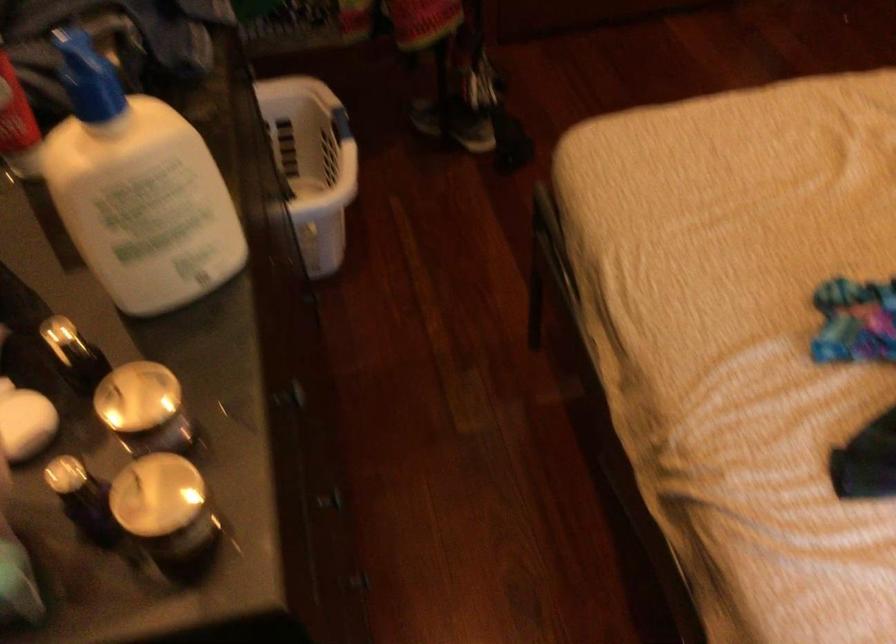
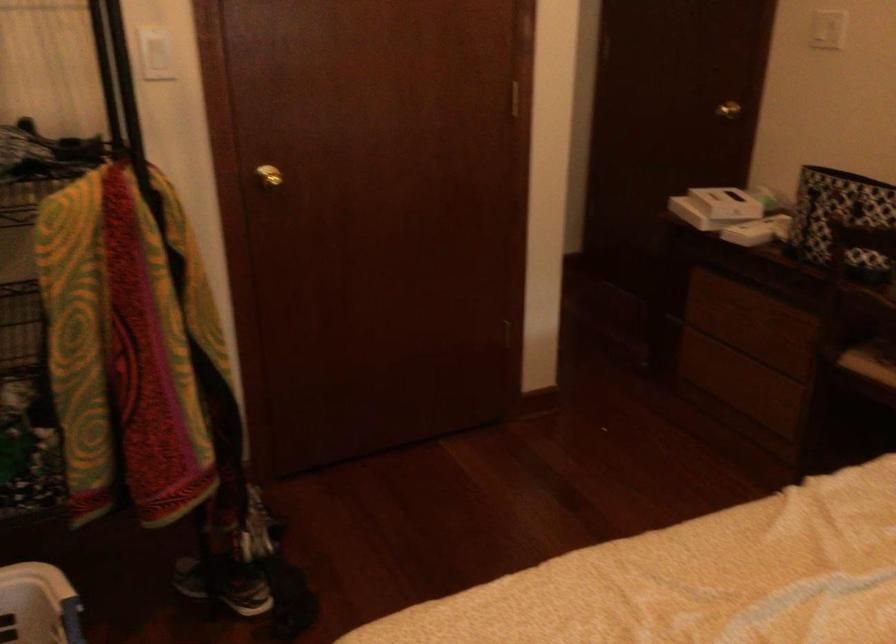
Where in the second image is the point corresponding to [309,111] from the first image?

(38, 605)